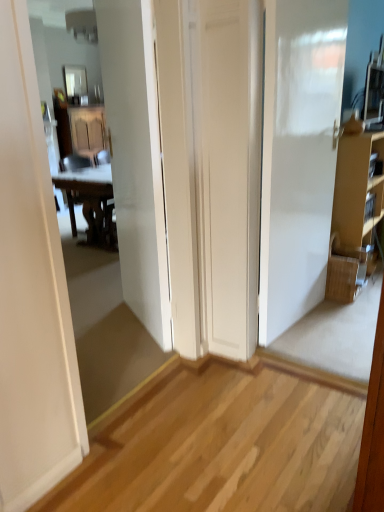
Question: Can you confirm if brown cardboard cabinet at right is bigger than wooden at left?

Choices:
 (A) yes
 (B) no

Answer: (A)

Question: Is wooden at left inside brown cardboard cabinet at right?

Choices:
 (A) yes
 (B) no

Answer: (B)

Question: From a real-world perspective, is brown cardboard cabinet at right positioned over wooden at left based on gravity?

Choices:
 (A) yes
 (B) no

Answer: (A)

Question: From a real-world perspective, is brown cardboard cabinet at right located beneath wooden at left?

Choices:
 (A) yes
 (B) no

Answer: (B)

Question: Is brown cardboard cabinet at right in front of wooden at left?

Choices:
 (A) yes
 (B) no

Answer: (A)

Question: From a real-world perspective, is woven brown picnic basket at right positioned above or below white glossy door at center?

Choices:
 (A) below
 (B) above

Answer: (A)

Question: In terms of size, does woven brown picnic basket at right appear bigger or smaller than white glossy door at center?

Choices:
 (A) small
 (B) big

Answer: (A)

Question: Is point (344, 260) closer or farther from the camera than point (152, 279)?

Choices:
 (A) farther
 (B) closer

Answer: (A)

Question: In the image, is woven brown picnic basket at right positioned in front of or behind white glossy door at center?

Choices:
 (A) front
 (B) behind

Answer: (B)

Question: In the image, is glossy glass mirror at upper center positioned in front of or behind woven brown picnic basket at right?

Choices:
 (A) behind
 (B) front

Answer: (A)

Question: From the image's perspective, is glossy glass mirror at upper center above or below woven brown picnic basket at right?

Choices:
 (A) above
 (B) below

Answer: (A)

Question: Does point (71, 79) appear closer or farther from the camera than point (345, 288)?

Choices:
 (A) closer
 (B) farther

Answer: (B)

Question: From a real-world perspective, is glossy glass mirror at upper center physically located above or below woven brown picnic basket at right?

Choices:
 (A) below
 (B) above

Answer: (B)

Question: Looking at the image, does woven brown picnic basket at right seem bigger or smaller compared to glossy glass mirror at upper center?

Choices:
 (A) big
 (B) small

Answer: (A)

Question: Relative to glossy glass mirror at upper center, is woven brown picnic basket at right in front or behind?

Choices:
 (A) behind
 (B) front

Answer: (B)